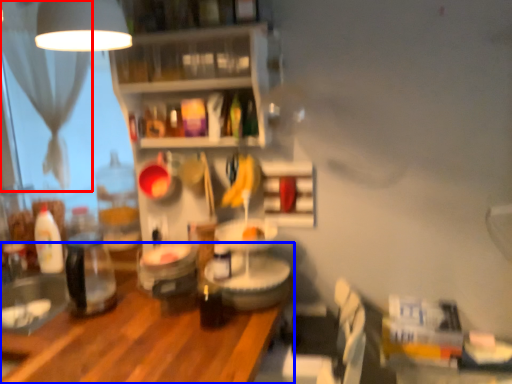
Question: Which object appears closest to the camera in this image, curtain (highlighted by a red box) or table (highlighted by a blue box)?

Choices:
 (A) curtain
 (B) table

Answer: (B)